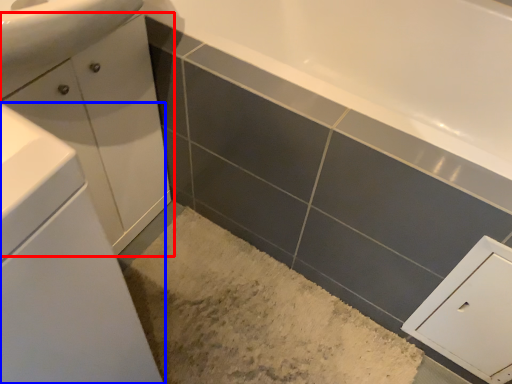
Question: Which point is closer to the camera, bathroom cabinet (highlighted by a red box) or bathroom cabinet (highlighted by a blue box)?

Choices:
 (A) bathroom cabinet
 (B) bathroom cabinet

Answer: (B)